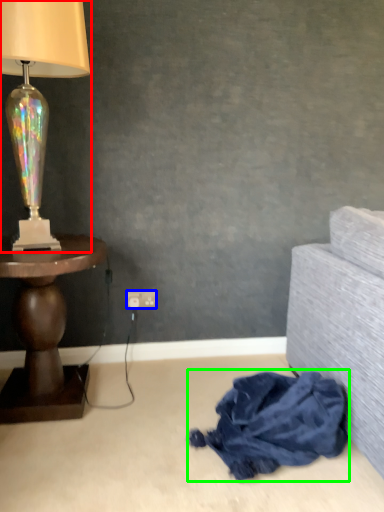
Question: Based on their relative distances, which object is farther from lamp (highlighted by a red box)? Choose from power outlet (highlighted by a blue box) and material (highlighted by a green box).

Choices:
 (A) power outlet
 (B) material

Answer: (B)